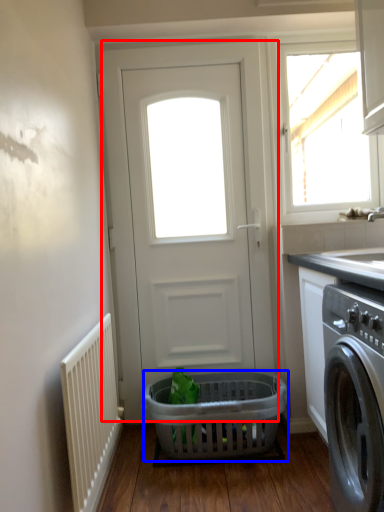
Question: Which point is further to the camera, door (highlighted by a red box) or basket (highlighted by a blue box)?

Choices:
 (A) door
 (B) basket

Answer: (A)